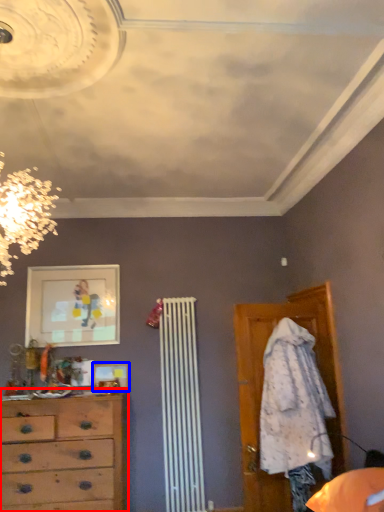
Question: Which of the following is the closest to the observer, chest of drawers (highlighted by a red box) or picture frame (highlighted by a blue box)?

Choices:
 (A) chest of drawers
 (B) picture frame

Answer: (A)